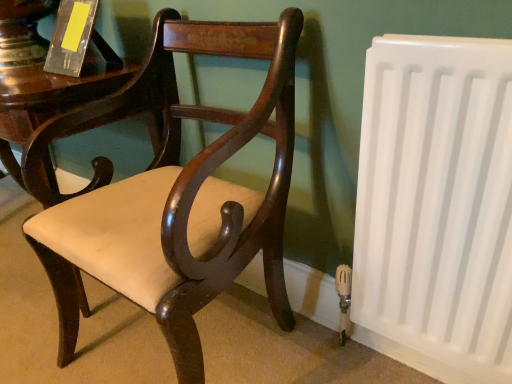
Question: Is point (484, 44) closer or farther from the camera than point (86, 3)?

Choices:
 (A) closer
 (B) farther

Answer: (A)

Question: In terms of size, does white plastic radiator at right appear bigger or smaller than translucent acrylic book at upper left?

Choices:
 (A) small
 (B) big

Answer: (B)

Question: Estimate the real-world distances between objects in this image. Which object is closer to the white plastic radiator at right?

Choices:
 (A) matte wood chair at center
 (B) translucent acrylic book at upper left

Answer: (A)

Question: Which is farther from the matte wood chair at center?

Choices:
 (A) translucent acrylic book at upper left
 (B) white plastic radiator at right

Answer: (A)